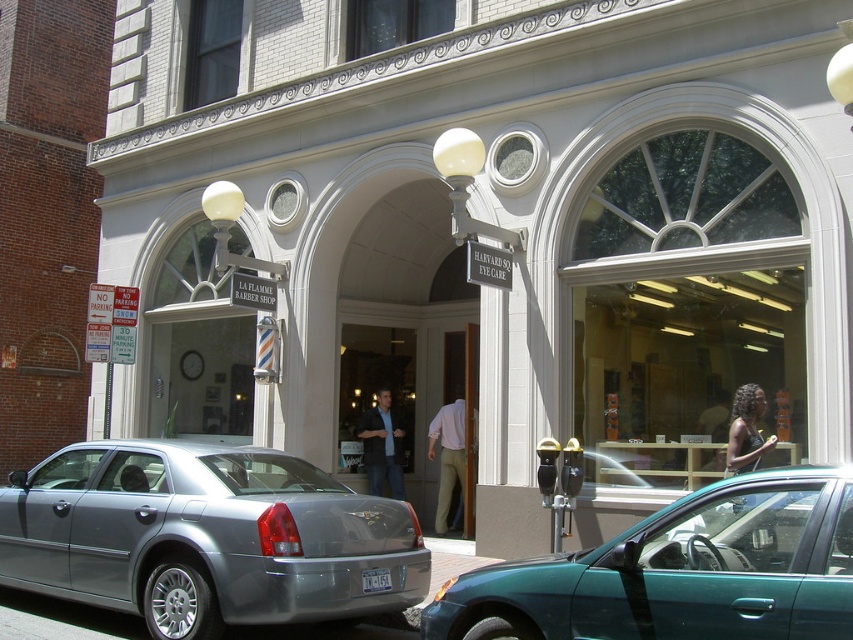
Can you confirm if silver metallic sedan at lower left is thinner than light brown wood door at center?

No, silver metallic sedan at lower left is not thinner than light brown wood door at center.

Can you confirm if silver metallic sedan at lower left is positioned below light brown wood door at center?

Yes, silver metallic sedan at lower left is below light brown wood door at center.

Who is more forward, (258,536) or (468,486)?

Point (258,536) is in front.

This screenshot has height=640, width=853. In order to click on silver metallic sedan at lower left in this screenshot , I will do coord(206,536).

Measure the distance between silver metallic sedan at lower left and camera.

silver metallic sedan at lower left and camera are 5.42 meters apart from each other.

Is silver metallic sedan at lower left bigger than matte glass door at center?

Yes, silver metallic sedan at lower left is bigger than matte glass door at center.

Describe the element at coordinates (206, 536) in the screenshot. The width and height of the screenshot is (853, 640). I see `silver metallic sedan at lower left` at that location.

At what (x,y) coordinates should I click in order to perform the action: click on silver metallic sedan at lower left. Please return your answer as a coordinate pair (x, y). Looking at the image, I should click on (206, 536).

Who is taller, matte glass door at center or gray asphalt at lower center?

Standing taller between the two is matte glass door at center.

Between matte glass door at center and gray asphalt at lower center, which one is positioned higher?

matte glass door at center

Describe the element at coordinates (404, 380) in the screenshot. I see `matte glass door at center` at that location.

I want to click on matte glass door at center, so click(404, 380).